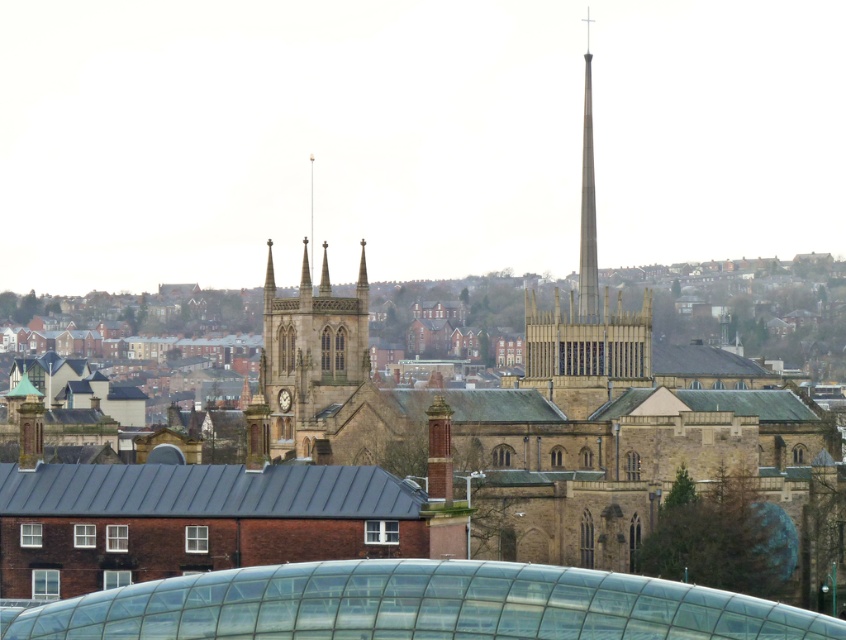
Can you confirm if brown stone tower at center is positioned below smooth stone spire at center?

Yes, brown stone tower at center is below smooth stone spire at center.

Who is more forward, (322, 259) or (600, 355)?

Point (600, 355) is more forward.

Identify the location of brown stone tower at center. Image resolution: width=846 pixels, height=640 pixels. (309, 358).

Who is more forward, [640,312] or [594,230]?

Point [640,312] is more forward.

Is smooth stone spire at center shorter than smooth gray spire at center?

In fact, smooth stone spire at center may be taller than smooth gray spire at center.

Identify the location of smooth stone spire at center. (585, 320).

Can you confirm if brown stone tower at center is positioned below smooth gray spire at center?

Yes.

Between brown stone tower at center and smooth gray spire at center, which one has more height?

With more height is smooth gray spire at center.

Between point (295, 317) and point (586, 320), which one is positioned in front?

Point (586, 320)

Locate an element on the screen. brown stone tower at center is located at coordinates (309, 358).